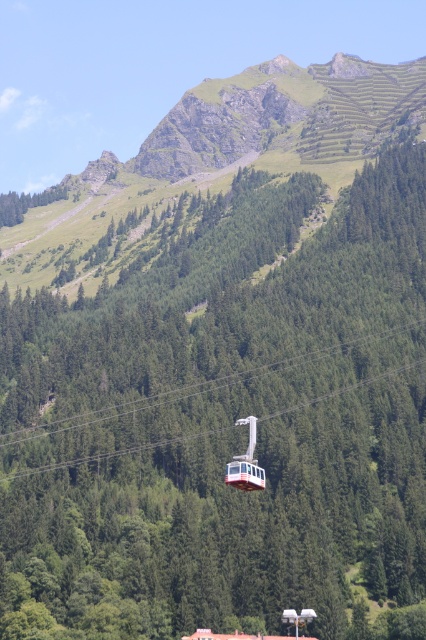
Question: Is white glossy cable car at center positioned behind metallic cable car at center?

Choices:
 (A) yes
 (B) no

Answer: (B)

Question: In this image, where is white glossy cable car at center located relative to green leafy tree at upper left?

Choices:
 (A) left
 (B) right

Answer: (B)

Question: Among these objects, which one is farthest from the camera?

Choices:
 (A) metallic cable car at center
 (B) white glossy cable car at center
 (C) green grassy mountain at upper center

Answer: (C)

Question: Is white glossy cable car at center to the right of green leafy tree at upper left from the viewer's perspective?

Choices:
 (A) no
 (B) yes

Answer: (B)

Question: Which of the following is the closest to the observer?

Choices:
 (A) (238, 97)
 (B) (245, 483)

Answer: (B)

Question: Which of the following is the closest to the observer?

Choices:
 (A) green leafy tree at upper left
 (B) metallic cable car at center
 (C) green grassy mountain at upper center
 (D) white glossy cable car at center

Answer: (D)